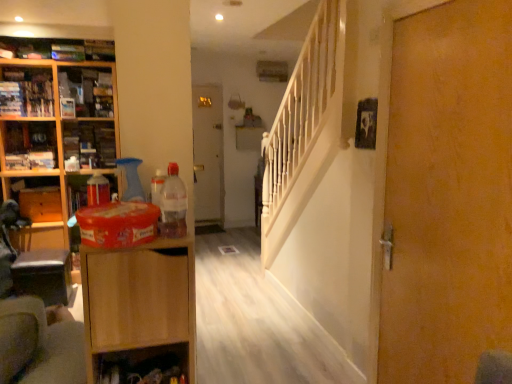
Question: Relative to light brown wood cabinet at left, the first cabinetry from the front, is wooden drawer at left in front or behind?

Choices:
 (A) behind
 (B) front

Answer: (A)

Question: From a real-world perspective, is wooden drawer at left physically located above or below light brown wood cabinet at left, the first cabinetry from the front?

Choices:
 (A) above
 (B) below

Answer: (B)

Question: Which object is positioned farthest from the matte plastic container at left, arranged as the 3th cabinet when viewed from the back?

Choices:
 (A) wooden cabinet at left, marked as the second cabinet in a left-to-right arrangement
 (B) translucent plastic bottle at center
 (C) wooden drawer at left
 (D) wooden cabinet at left, which appears as the 1th cabinetry when viewed from the back
 (E) wooden shelf at lower center

Answer: (B)

Question: Which object is the closest to the light brown wood cabinet at left, the 2th cabinetry in the back-to-front sequence?

Choices:
 (A) wooden door at right, the first door in the front-to-back sequence
 (B) white glossy door at center, placed as the 1th door when sorted from back to front
 (C) matte plastic container at left, the first cabinet when ordered from right to left
 (D) wooden bookshelf at upper left, the second cabinet when ordered from front to back
 (E) wooden cabinet at left, which is the second cabinetry in right-to-left order

Answer: (A)